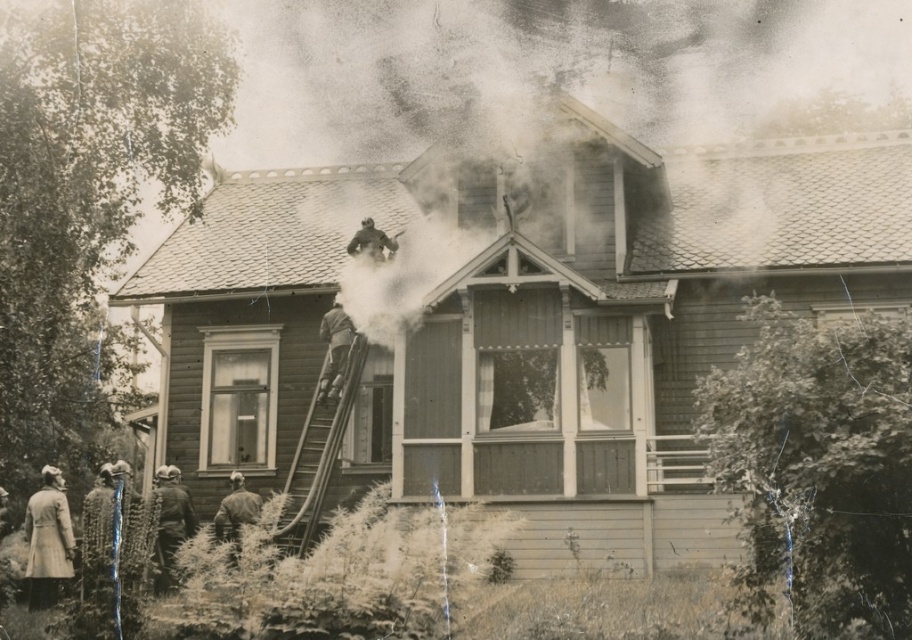
Is dark brown leather jacket at lower left to the right of wooden ladder at upper center from the viewer's perspective?

In fact, dark brown leather jacket at lower left is to the left of wooden ladder at upper center.

Is dark brown leather jacket at lower left behind wooden ladder at upper center?

No, dark brown leather jacket at lower left is closer to the viewer.

Locate an element on the screen. This screenshot has width=912, height=640. dark brown leather jacket at lower left is located at coordinates (171, 522).

The image size is (912, 640). I want to click on dark brown leather jacket at lower left, so click(x=171, y=522).

Can you confirm if dark brown leather jacket at lower left is bigger than brushed metal helmet at lower center?

Yes, dark brown leather jacket at lower left is bigger than brushed metal helmet at lower center.

Between point (166, 497) and point (225, 525), which one is positioned behind?

Point (166, 497)

Identify the location of dark brown leather jacket at lower left. The image size is (912, 640). (171, 522).

Is light brown coat at lower left wider than dark brown leather jacket at lower left?

No.

I want to click on light brown coat at lower left, so click(48, 540).

Where is `light brown coat at lower left`? light brown coat at lower left is located at coordinates (48, 540).